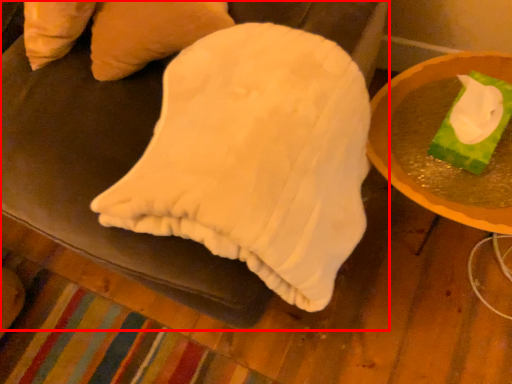
Question: Considering the relative positions of furniture (annotated by the red box) and table in the image provided, where is furniture (annotated by the red box) located with respect to the staircase?

Choices:
 (A) left
 (B) right

Answer: (A)